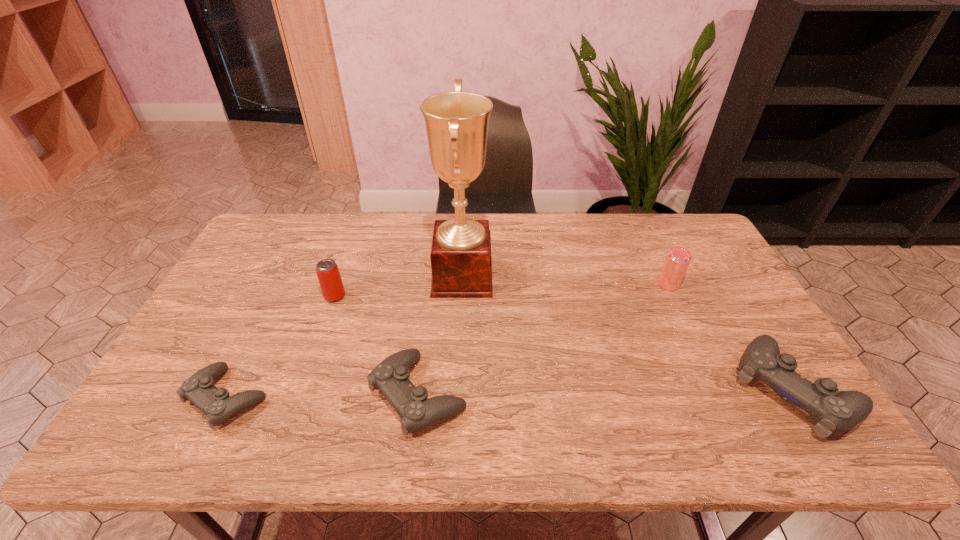
The width and height of the screenshot is (960, 540). What are the coordinates of `free spot that satisfies the following two spatial constraints: 1. on the plaque of the trophy cup; 2. on the left side of the rightmost object` in the screenshot? It's located at (457, 389).

I want to click on blank area in the image that satisfies the following two spatial constraints: 1. on the back side of the rightmost object; 2. on the left side of the fifth tallest object, so click(x=419, y=389).

Where is `blank area in the image that satisfies the following two spatial constraints: 1. on the plaque of the rightmost control; 2. on the left side of the trophy cup`? blank area in the image that satisfies the following two spatial constraints: 1. on the plaque of the rightmost control; 2. on the left side of the trophy cup is located at coordinates pos(457,389).